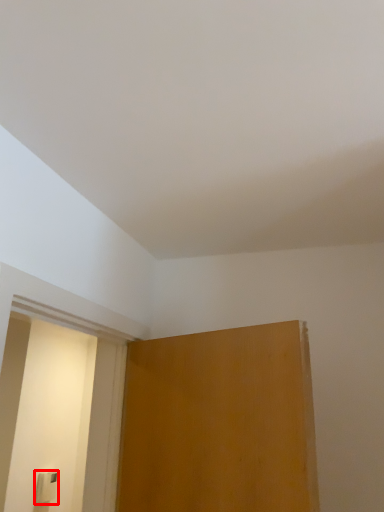
Question: From the image, what is the correct spatial relationship of light switch (annotated by the red box) in relation to screen door?

Choices:
 (A) left
 (B) right

Answer: (A)